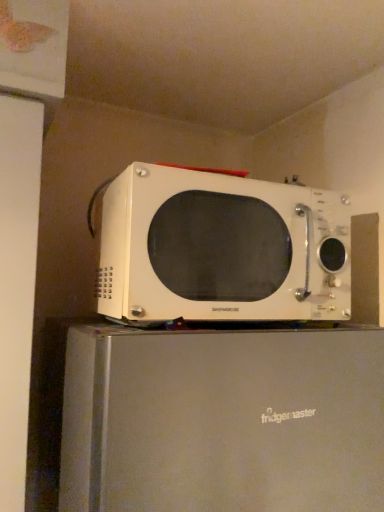
Question: In terms of height, does white matte microwave at upper center look taller or shorter compared to white matte microwave at center?

Choices:
 (A) tall
 (B) short

Answer: (A)

Question: From a real-world perspective, is white matte microwave at upper center positioned above or below white matte microwave at center?

Choices:
 (A) below
 (B) above

Answer: (A)

Question: In the image, is white matte microwave at upper center on the left side or the right side of white matte microwave at center?

Choices:
 (A) right
 (B) left

Answer: (B)

Question: Is white matte microwave at center spatially inside white matte microwave at upper center, or outside of it?

Choices:
 (A) inside
 (B) outside

Answer: (B)

Question: From a real-world perspective, relative to white matte microwave at upper center, is white matte microwave at center vertically above or below?

Choices:
 (A) above
 (B) below

Answer: (A)

Question: Considering the positions of white matte microwave at center and white matte microwave at upper center in the image, is white matte microwave at center bigger or smaller than white matte microwave at upper center?

Choices:
 (A) small
 (B) big

Answer: (A)

Question: In terms of width, does white matte microwave at center look wider or thinner when compared to white matte microwave at upper center?

Choices:
 (A) thin
 (B) wide

Answer: (A)